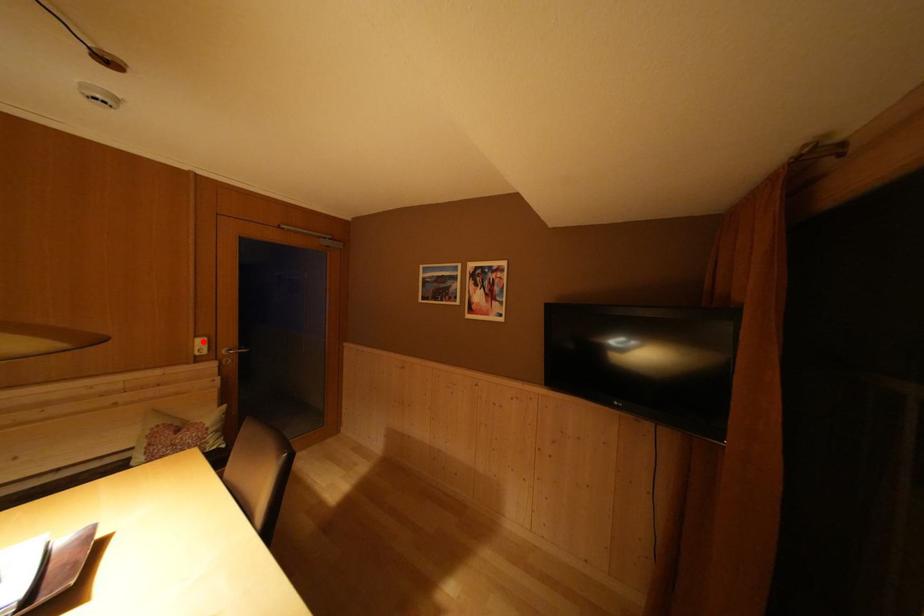
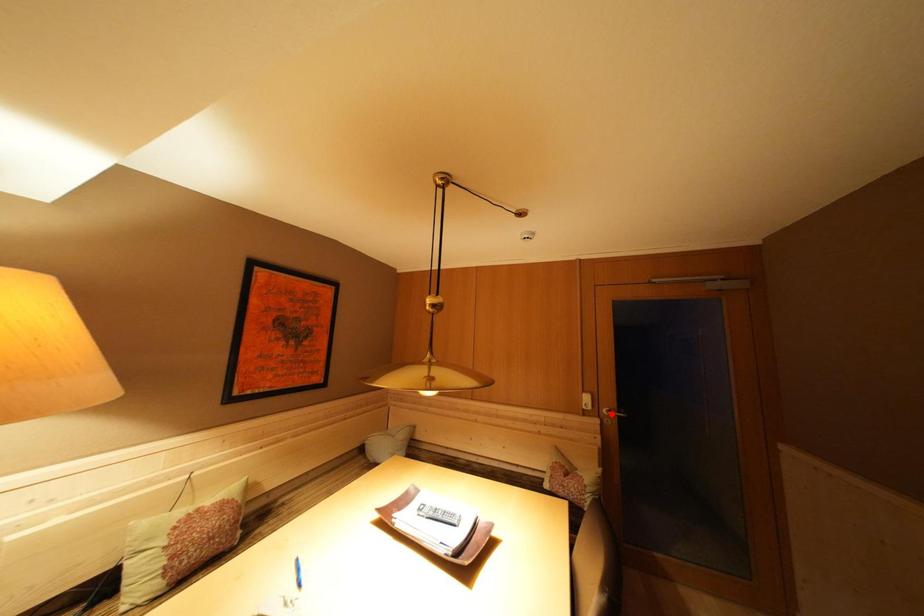
I am providing you with two images of the same scene from different viewpoints. A red point is marked on the first image and another point is marked on the second image. Do the highlighted points in image1 and image2 indicate the same real-world spot?

No